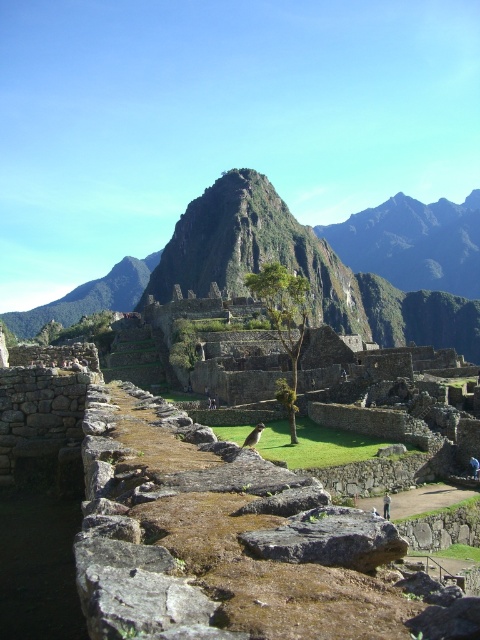
You are a hiker standing at the base of the green grassy mountain at center and the green leafy tree at center. Which one would you need to walk further to reach?

The green grassy mountain at center might be wider than the green leafy tree at center, so you would need to walk further to reach the green grassy mountain at center.